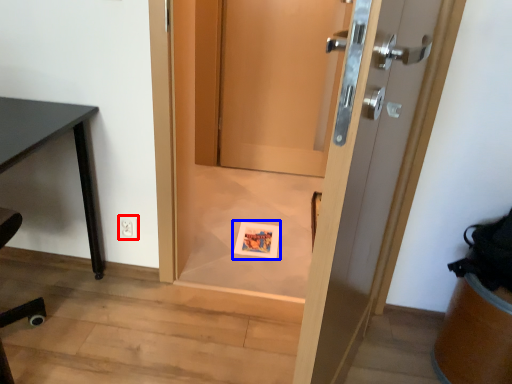
Question: Which object is further to the camera taking this photo, electric outlet (highlighted by a red box) or postcard (highlighted by a blue box)?

Choices:
 (A) electric outlet
 (B) postcard

Answer: (B)